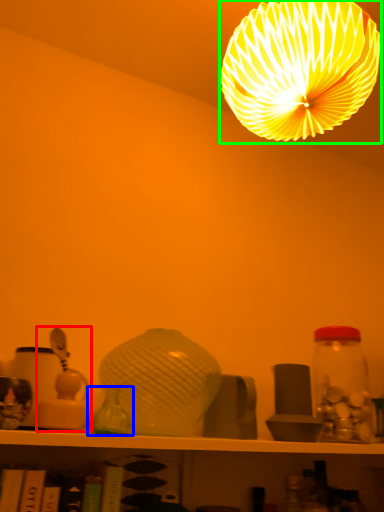
Question: Estimate the real-world distances between objects in this image. Which object is closer to toy (highlighted by a red box), glass vase (highlighted by a blue box) or lamp (highlighted by a green box)?

Choices:
 (A) glass vase
 (B) lamp

Answer: (A)